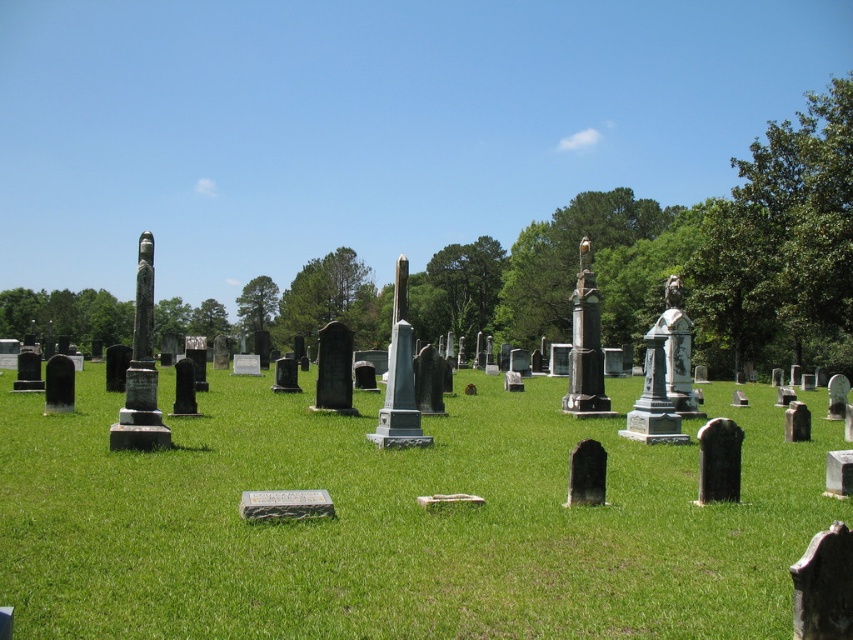
Question: Which is nearer to the polished bronze statue at center-right?

Choices:
 (A) green stone monument at center
 (B) green leafy tree at upper right
 (C) green marble monument at center
 (D) green leafy tree at center

Answer: (C)

Question: Based on their relative distances, which object is farther from the green stone monument at center?

Choices:
 (A) green leafy tree at upper right
 (B) polished bronze statue at center-right
 (C) green marble monument at center
 (D) polished stone statue at center

Answer: (B)

Question: Does green leafy tree at upper right appear on the right side of polished bronze statue at center-right?

Choices:
 (A) yes
 (B) no

Answer: (A)

Question: Is green leafy tree at upper right positioned behind polished stone statue at center?

Choices:
 (A) yes
 (B) no

Answer: (A)

Question: Does green grass at center have a larger size compared to green leafy tree at center?

Choices:
 (A) no
 (B) yes

Answer: (A)

Question: Which point is farther to the camera?

Choices:
 (A) (846, 176)
 (B) (149, 422)
 (C) (3, 304)
 (D) (260, 280)

Answer: (C)